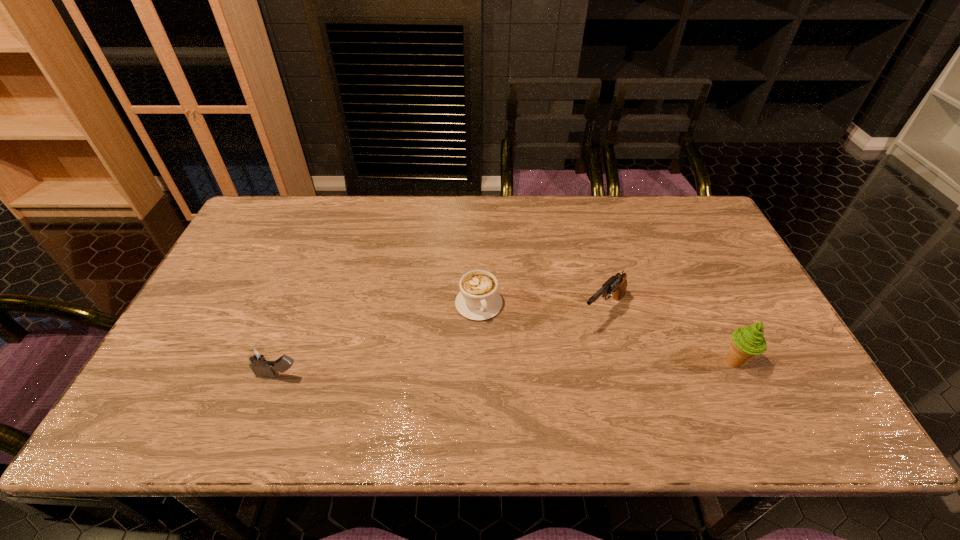
Find the location of a particular element. vacant space on the desktop that is between the leftmost object and the tallest object and is positioned along the barrel of the gun is located at coordinates (543, 367).

The height and width of the screenshot is (540, 960). Identify the location of vacant spot on the desktop that is between the igniter and the rightmost object and is positioned to the right of the cappuccino's handle. (504, 369).